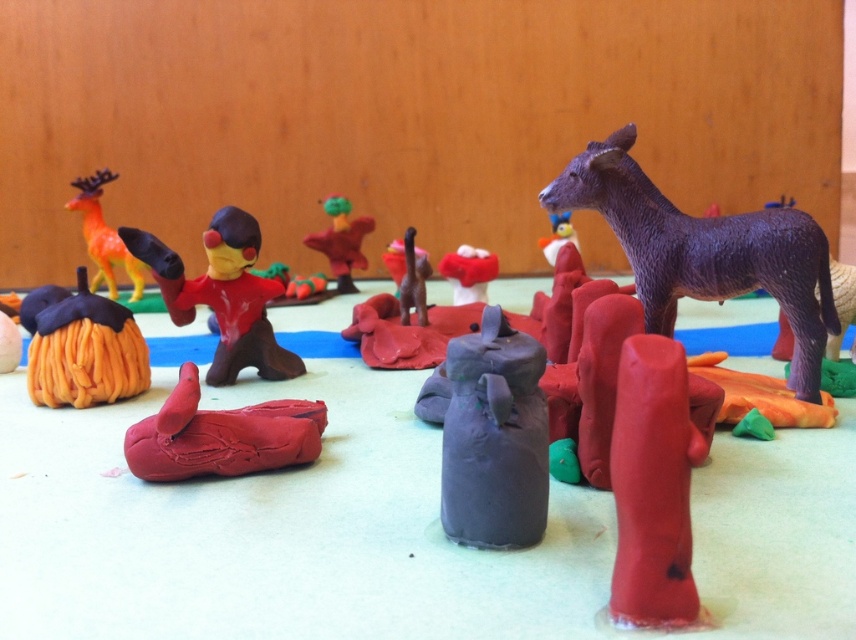
Who is shorter, orange yarn pumpkin at lower left or orange plastic deer at left?

With less height is orange yarn pumpkin at lower left.

Can you confirm if orange yarn pumpkin at lower left is positioned above orange plastic deer at left?

Incorrect, orange yarn pumpkin at lower left is not positioned above orange plastic deer at left.

I want to click on orange yarn pumpkin at lower left, so click(x=85, y=352).

Identify the location of orange yarn pumpkin at lower left. (85, 352).

Does orange yarn pumpkin at lower left have a greater width compared to rubber duck at center?

Yes, orange yarn pumpkin at lower left is wider than rubber duck at center.

Who is more forward, (56, 376) or (342, 228)?

Point (56, 376)

Is point (129, 365) positioned in front of point (363, 220)?

Yes, it is in front of point (363, 220).

Identify the location of orange yarn pumpkin at lower left. (85, 352).

Find the location of a particular element. This screenshot has height=640, width=856. matte gray jug at center is located at coordinates (494, 436).